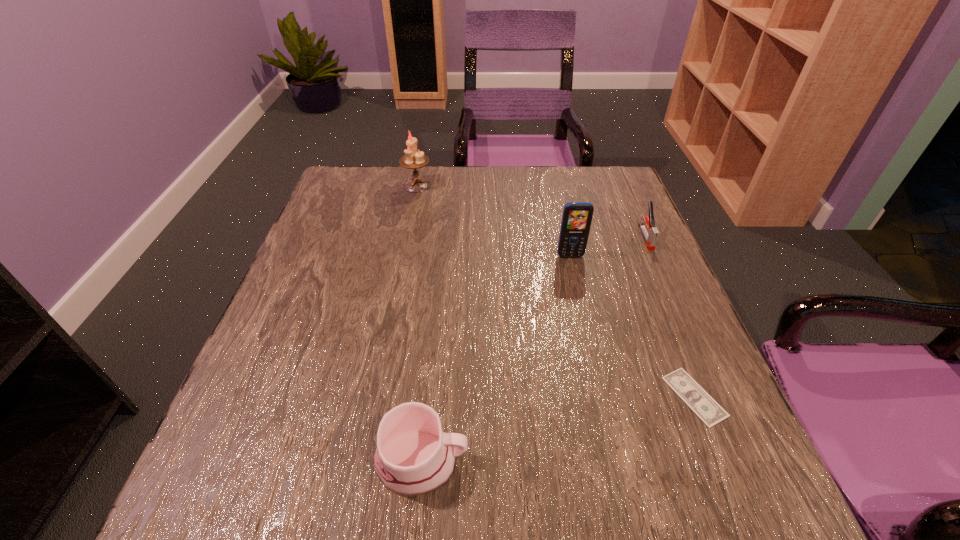
I want to click on the farthest object, so click(x=413, y=159).

Where is `the third nearest object`? The width and height of the screenshot is (960, 540). the third nearest object is located at coordinates (576, 221).

At what (x,y) coordinates should I click in order to perform the action: click on the third object from right to left. Please return your answer as a coordinate pair (x, y). Looking at the image, I should click on (576, 221).

Locate an element on the screen. This screenshot has height=540, width=960. stapler is located at coordinates (651, 234).

This screenshot has height=540, width=960. What are the coordinates of `the nearest object` in the screenshot? It's located at (413, 457).

The image size is (960, 540). Identify the location of the fourth farthest object. (695, 397).

Identify the location of the shortest object. (695, 397).

The image size is (960, 540). In order to click on free spot located on the left of the candle holder in this screenshot , I will do `click(335, 185)`.

Image resolution: width=960 pixels, height=540 pixels. I want to click on free region located 0.330m on the screen of the third object from left to right, so click(x=600, y=384).

At what (x,y) coordinates should I click in order to perform the action: click on vacant space located 0.270m on the handle side of the stapler. Please return your answer as a coordinate pair (x, y). The width and height of the screenshot is (960, 540). Looking at the image, I should click on (692, 342).